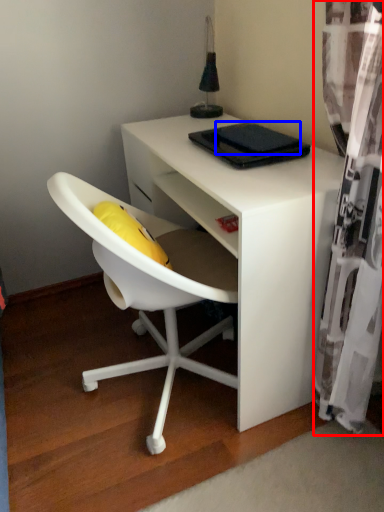
Question: Among these objects, which one is nearest to the camera, curtain (highlighted by a red box) or pad (highlighted by a blue box)?

Choices:
 (A) curtain
 (B) pad

Answer: (A)